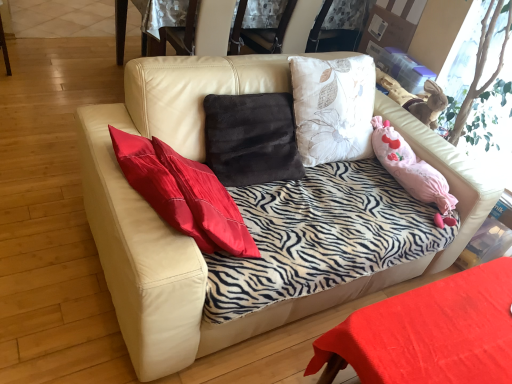
I want to click on vacant area on top of smooth red table at lower right (from a real-world perspective), so click(x=466, y=324).